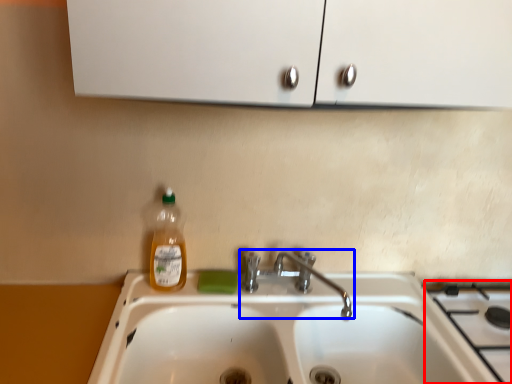
Question: Among these objects, which one is nearest to the camera, gas stove (highlighted by a red box) or tap (highlighted by a blue box)?

Choices:
 (A) gas stove
 (B) tap

Answer: (A)